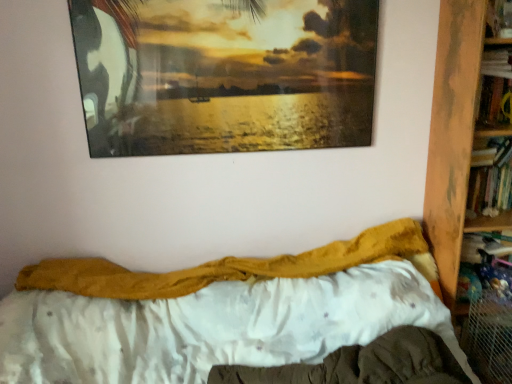
Question: Relative to mustard yellow fabric at center, is fuzzy yellow blanket at center in front or behind?

Choices:
 (A) front
 (B) behind

Answer: (A)

Question: Is fuzzy yellow blanket at center to the left or to the right of mustard yellow fabric at center in the image?

Choices:
 (A) left
 (B) right

Answer: (A)

Question: Estimate the real-world distances between objects in this image. Which object is closer to the wooden bookcase at right?

Choices:
 (A) metallic glossy picture frame at upper center
 (B) mustard yellow fabric at center
 (C) fuzzy yellow blanket at center
 (D) white satin mattress at lower center

Answer: (B)

Question: Which is nearer to the wooden bookcase at right?

Choices:
 (A) mustard yellow fabric at center
 (B) metallic glossy picture frame at upper center
 (C) fuzzy yellow blanket at center
 (D) white satin mattress at lower center

Answer: (A)